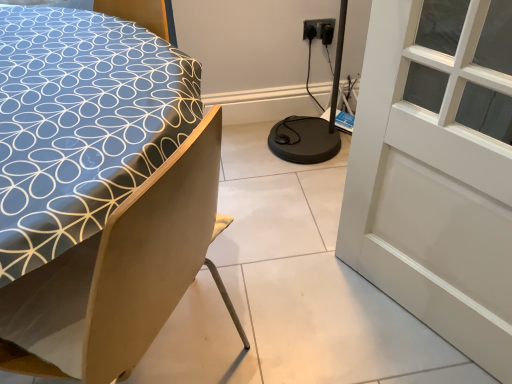
Question: From a real-world perspective, is blue fabric bed at left positioned over white glass window at upper right based on gravity?

Choices:
 (A) yes
 (B) no

Answer: (B)

Question: Considering the relative sizes of blue fabric bed at left and white glass window at upper right in the image provided, is blue fabric bed at left taller than white glass window at upper right?

Choices:
 (A) yes
 (B) no

Answer: (A)

Question: Could you tell me if blue fabric bed at left is facing white glass window at upper right?

Choices:
 (A) yes
 (B) no

Answer: (B)

Question: From a real-world perspective, is blue fabric bed at left located beneath white glass window at upper right?

Choices:
 (A) yes
 (B) no

Answer: (A)

Question: Is blue fabric bed at left far from white glass window at upper right?

Choices:
 (A) yes
 (B) no

Answer: (B)

Question: Considering the positions of white glass window at upper right and blue fabric bed at left in the image, is white glass window at upper right bigger or smaller than blue fabric bed at left?

Choices:
 (A) big
 (B) small

Answer: (B)

Question: From the image's perspective, is white glass window at upper right located above or below blue fabric bed at left?

Choices:
 (A) below
 (B) above

Answer: (B)

Question: Would you say white glass window at upper right is inside or outside blue fabric bed at left?

Choices:
 (A) inside
 (B) outside

Answer: (B)

Question: Considering the positions of white glass window at upper right and blue fabric bed at left in the image, is white glass window at upper right taller or shorter than blue fabric bed at left?

Choices:
 (A) tall
 (B) short

Answer: (B)

Question: Would you say white glass window at upper right is inside or outside black plastic electric outlet at upper right?

Choices:
 (A) inside
 (B) outside

Answer: (B)

Question: Does point (419, 96) appear closer or farther from the camera than point (324, 19)?

Choices:
 (A) closer
 (B) farther

Answer: (A)

Question: Considering their positions, is white glass window at upper right located in front of or behind black plastic electric outlet at upper right?

Choices:
 (A) front
 (B) behind

Answer: (A)

Question: From the image's perspective, relative to black plastic electric outlet at upper right, is white glass window at upper right above or below?

Choices:
 (A) below
 (B) above

Answer: (A)

Question: Looking at their shapes, would you say blue fabric bed at left is wider or thinner than white glass window at upper right?

Choices:
 (A) wide
 (B) thin

Answer: (A)

Question: Considering the positions of blue fabric bed at left and white glass window at upper right in the image, is blue fabric bed at left taller or shorter than white glass window at upper right?

Choices:
 (A) short
 (B) tall

Answer: (B)